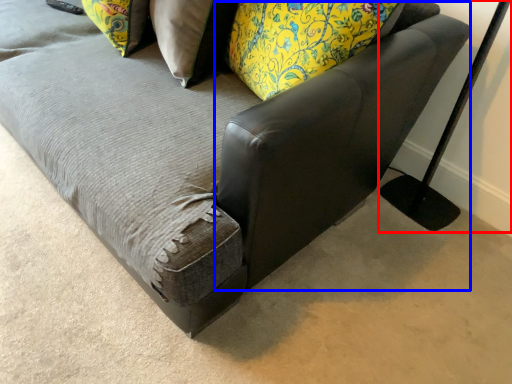
Question: Which object appears closest to the camera in this image, table lamp (highlighted by a red box) or swivel chair (highlighted by a blue box)?

Choices:
 (A) table lamp
 (B) swivel chair

Answer: (B)